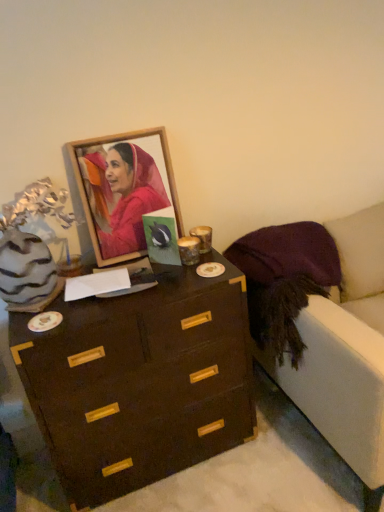
This screenshot has width=384, height=512. In order to click on free space above dark wood chest of drawers at center (from a real-world perspective) in this screenshot , I will do `click(129, 289)`.